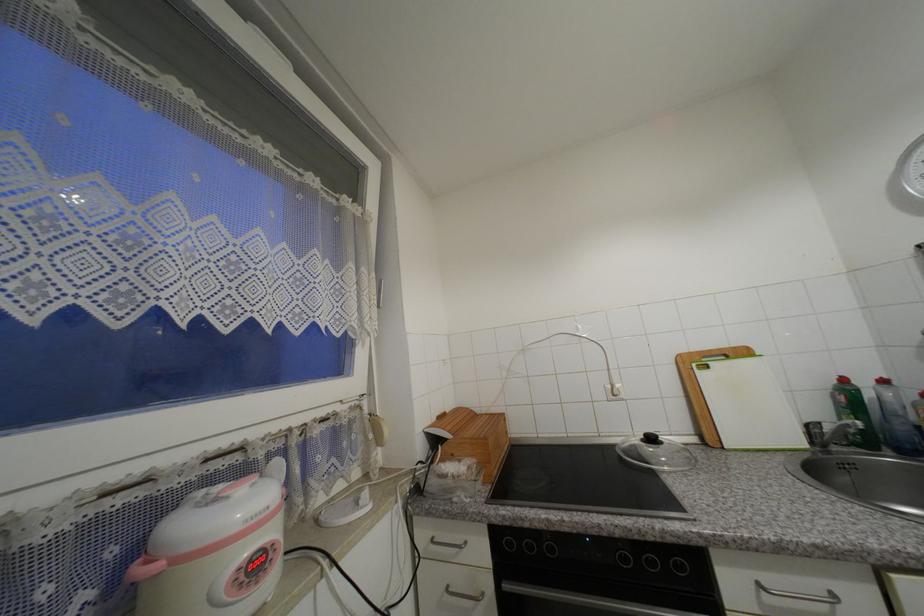
What do you see at coordinates (599, 575) in the screenshot?
I see `a oven door handle` at bounding box center [599, 575].